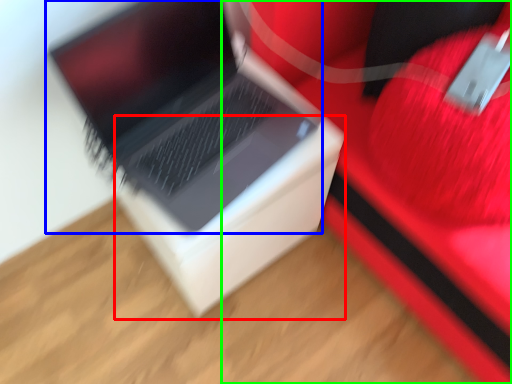
Question: Which object is positioned farthest from cardboard box (highlighted by a red box)? Select from laptop (highlighted by a blue box) and furniture (highlighted by a green box).

Choices:
 (A) laptop
 (B) furniture

Answer: (B)